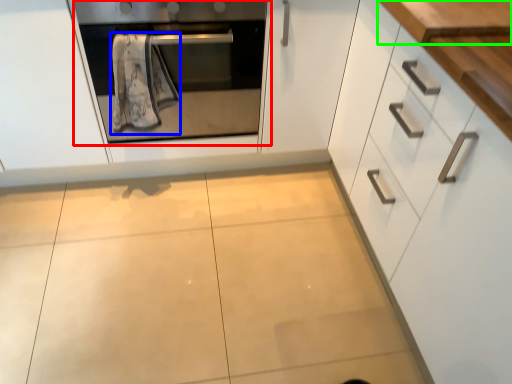
Question: Estimate the real-world distances between objects in this image. Which object is closer to oven (highlighted by a red box), bath towel (highlighted by a blue box) or counter top (highlighted by a green box)?

Choices:
 (A) bath towel
 (B) counter top

Answer: (A)